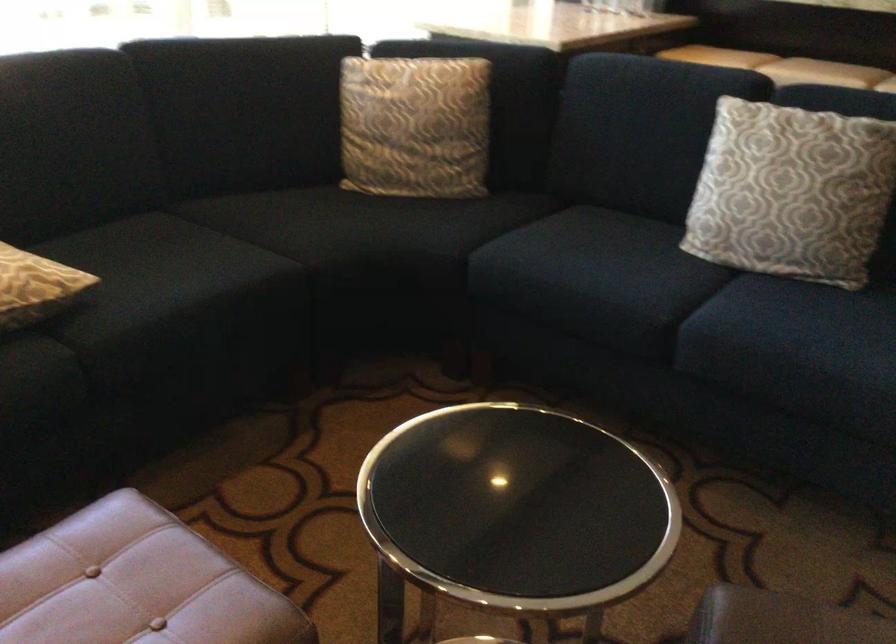
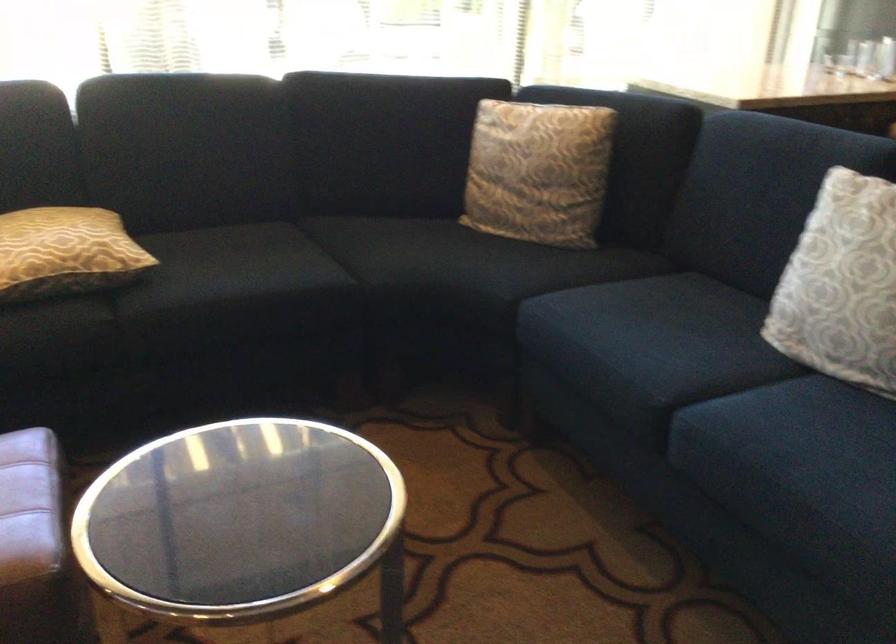
In the second image, find the point that corresponds to point 762,200 in the first image.

(841, 285)